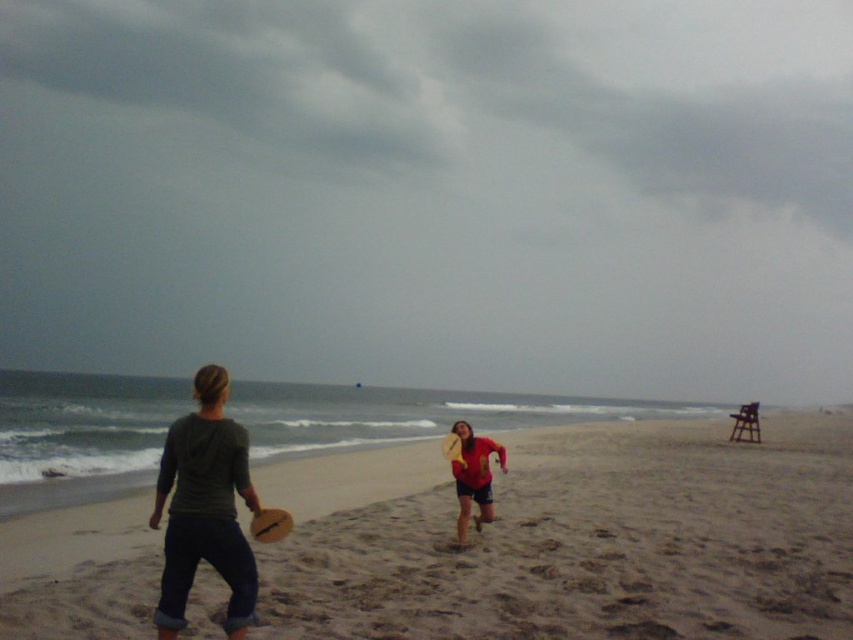
You are a photographer trying to capture the two people in the beach scene. Since the dark gray hoodie at center and wooden frisbee at center are both at the center, which one is positioned to the left?

The dark gray hoodie at center is to the left of wooden frisbee at center, so the dark gray hoodie at center is positioned to the left.

You are standing on the beach and see the red matte shirt at center and the wooden frisbee at center. Which object is closer to the ground?

The red matte shirt at center is positioned under the wooden frisbee at center, so the red matte shirt at center is closer to the ground.